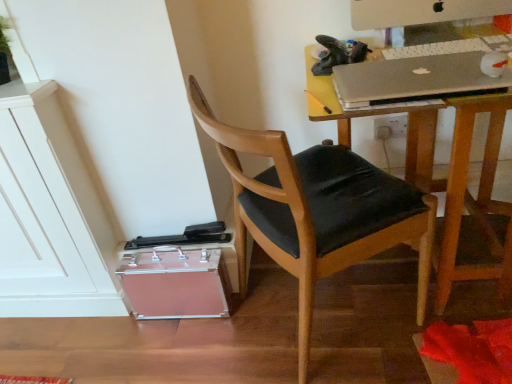
Question: Can you confirm if white plastic keyboard at upper right is thinner than metallic silver desk at upper right?

Choices:
 (A) yes
 (B) no

Answer: (A)

Question: Is the position of white plastic keyboard at upper right less distant than that of metallic silver desk at upper right?

Choices:
 (A) no
 (B) yes

Answer: (A)

Question: From the image's perspective, would you say white plastic keyboard at upper right is positioned over metallic silver desk at upper right?

Choices:
 (A) yes
 (B) no

Answer: (A)

Question: Is white plastic keyboard at upper right facing away from metallic silver desk at upper right?

Choices:
 (A) no
 (B) yes

Answer: (B)

Question: Can you confirm if white plastic keyboard at upper right is smaller than metallic silver desk at upper right?

Choices:
 (A) yes
 (B) no

Answer: (A)

Question: Relative to white plastic computer monitor at upper right, is silver metallic laptop at upper right in front or behind?

Choices:
 (A) front
 (B) behind

Answer: (A)

Question: Do you think silver metallic laptop at upper right is within white plastic computer monitor at upper right, or outside of it?

Choices:
 (A) inside
 (B) outside

Answer: (B)

Question: From the image's perspective, is silver metallic laptop at upper right located above or below white plastic computer monitor at upper right?

Choices:
 (A) below
 (B) above

Answer: (A)

Question: Is point (369, 79) positioned closer to the camera than point (372, 18)?

Choices:
 (A) closer
 (B) farther

Answer: (A)

Question: Is white plastic computer monitor at upper right in front of or behind silver metallic laptop at upper right in the image?

Choices:
 (A) behind
 (B) front

Answer: (A)

Question: Is white plastic computer monitor at upper right bigger or smaller than silver metallic laptop at upper right?

Choices:
 (A) small
 (B) big

Answer: (B)

Question: From the image's perspective, is white plastic computer monitor at upper right above or below silver metallic laptop at upper right?

Choices:
 (A) below
 (B) above

Answer: (B)

Question: Considering the positions of white plastic computer monitor at upper right and silver metallic laptop at upper right in the image, is white plastic computer monitor at upper right wider or thinner than silver metallic laptop at upper right?

Choices:
 (A) thin
 (B) wide

Answer: (A)

Question: Relative to wooden chair with black cushion at center, is white plastic computer monitor at upper right in front or behind?

Choices:
 (A) behind
 (B) front

Answer: (A)

Question: From a real-world perspective, is white plastic computer monitor at upper right above or below wooden chair with black cushion at center?

Choices:
 (A) above
 (B) below

Answer: (A)